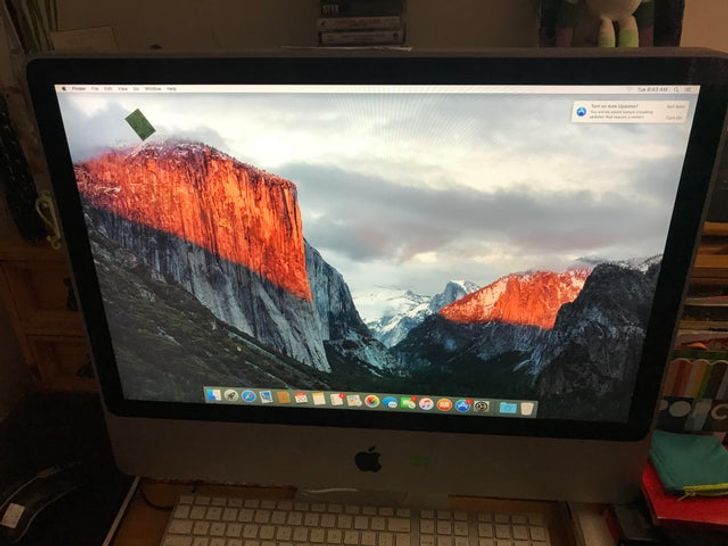
Where is `stuffed animal`? The height and width of the screenshot is (546, 728). stuffed animal is located at coordinates (613, 13).